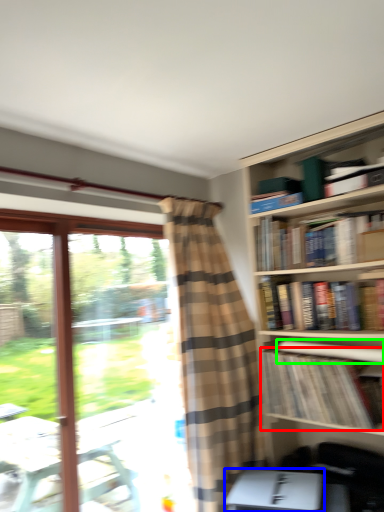
Question: Which is nearer to the book (highlighted by a red box)? paperback book (highlighted by a blue box) or book (highlighted by a green box).

Choices:
 (A) paperback book
 (B) book

Answer: (B)